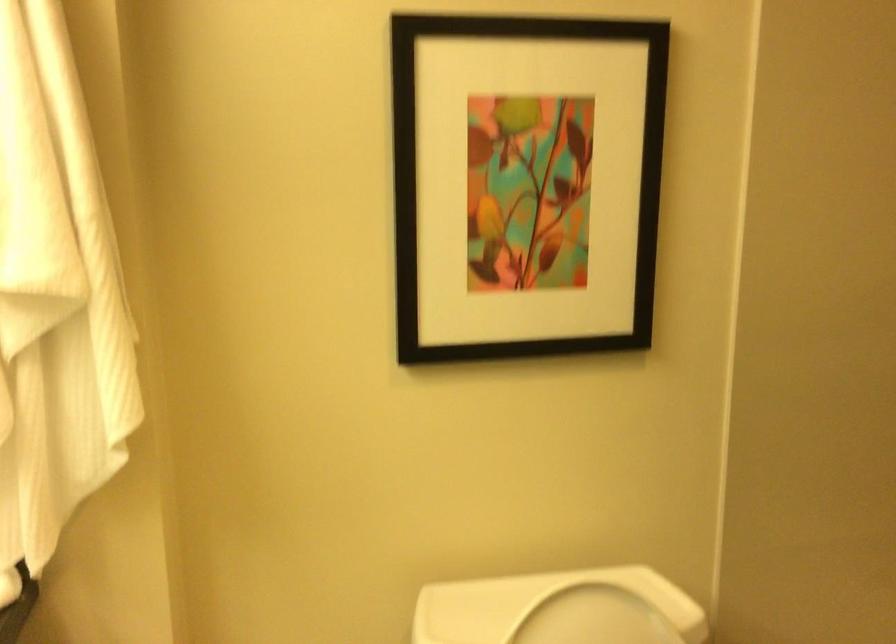
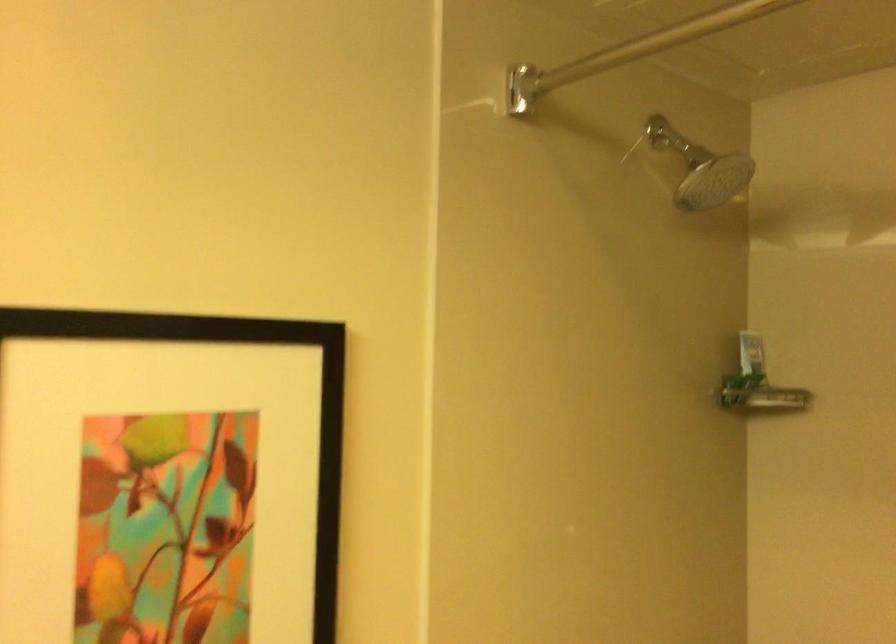
Question: The camera is either moving clockwise (left) or counter-clockwise (right) around the object. The first image is from the beginning of the video and the second image is from the end. Is the camera moving left or right when shooting the video?

Choices:
 (A) Left
 (B) Right

Answer: (A)